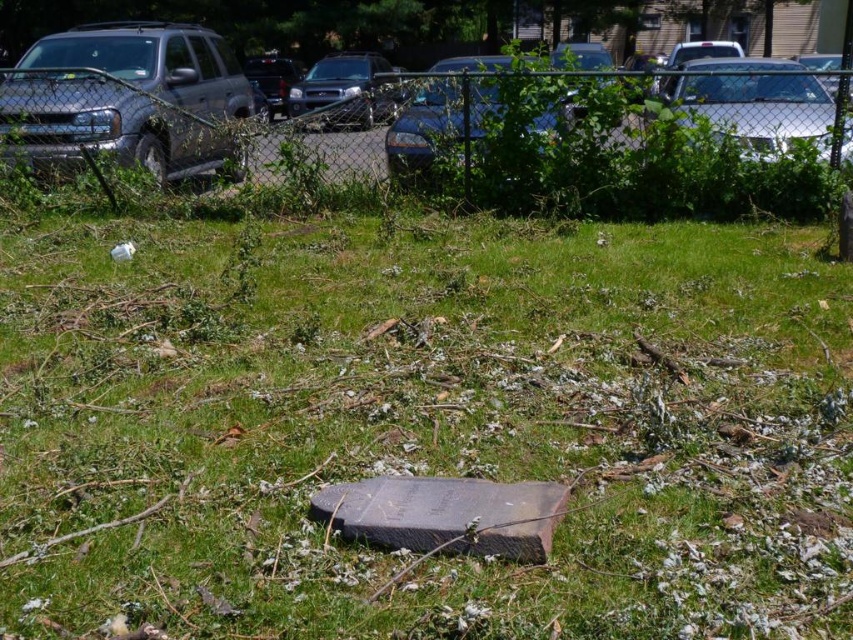
Does point (140, 84) come in front of point (722, 106)?

That is False.

Is point (99, 108) behind point (752, 58)?

No.

Image resolution: width=853 pixels, height=640 pixels. I want to click on brushed metal truck at left, so click(x=125, y=97).

Where is `brushed metal truck at left`? The width and height of the screenshot is (853, 640). brushed metal truck at left is located at coordinates (125, 97).

What do you see at coordinates (618, 147) in the screenshot? I see `metallic chain-link fence at upper center` at bounding box center [618, 147].

Is point (173, 124) positioned behind point (706, 76)?

Yes, it is.

At what (x,y) coordinates should I click in order to perform the action: click on metallic chain-link fence at upper center. Please return your answer as a coordinate pair (x, y). Image resolution: width=853 pixels, height=640 pixels. Looking at the image, I should click on (618, 147).

Does metallic chain-link fence at upper center appear under metallic silver car at center?

Correct, metallic chain-link fence at upper center is located below metallic silver car at center.

How far apart are metallic chain-link fence at upper center and metallic silver car at center?

metallic chain-link fence at upper center and metallic silver car at center are 7.95 meters apart.

Between point (561, 170) and point (296, 90), which one is positioned behind?

The point (296, 90) is behind.

Identify the location of metallic chain-link fence at upper center. Image resolution: width=853 pixels, height=640 pixels. (618, 147).